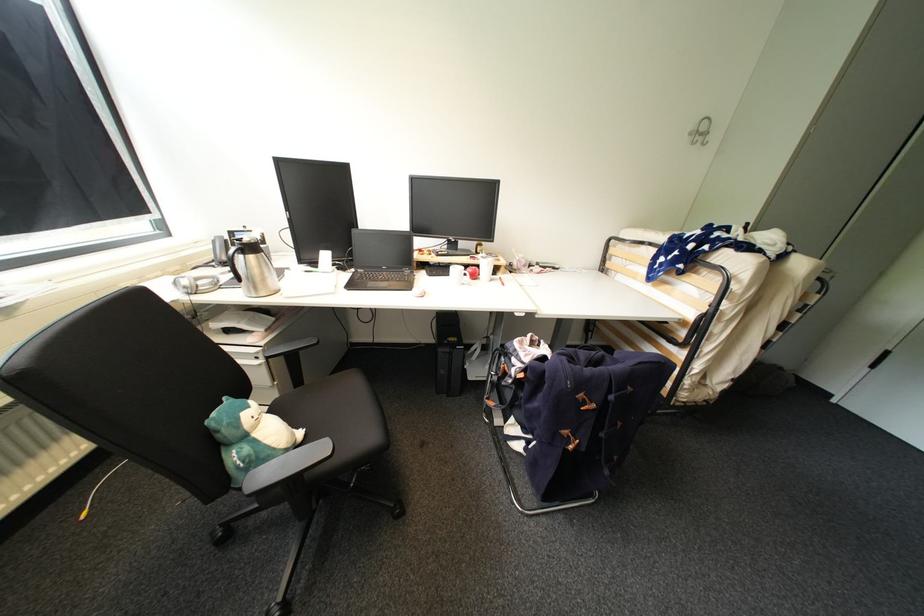
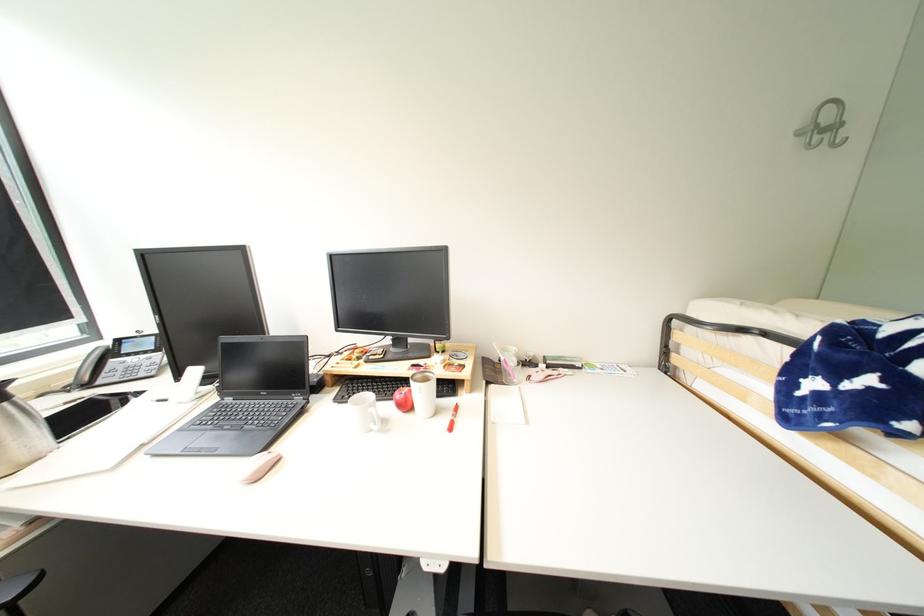
Question: How did the camera likely rotate?

Choices:
 (A) Left
 (B) Right
 (C) Up
 (D) Down

Answer: (C)